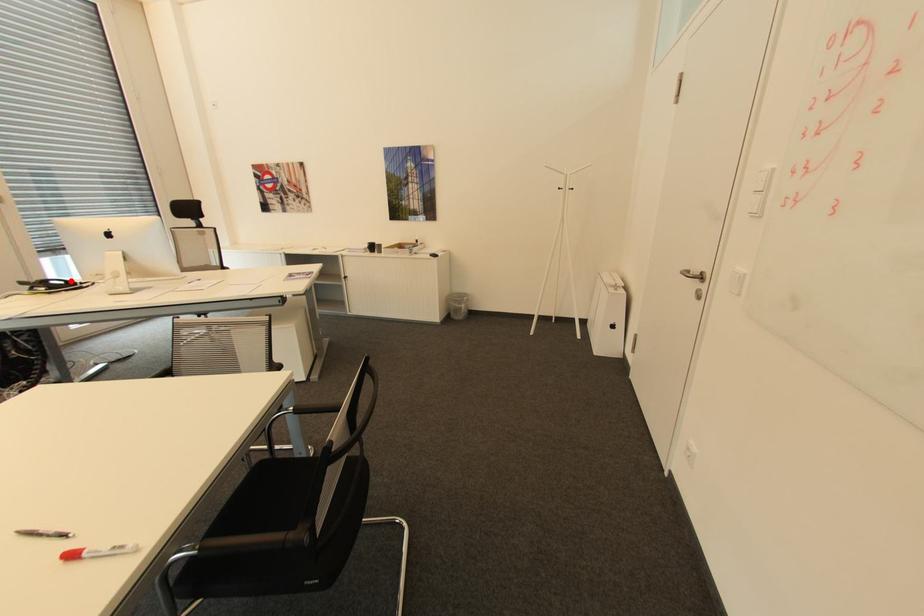
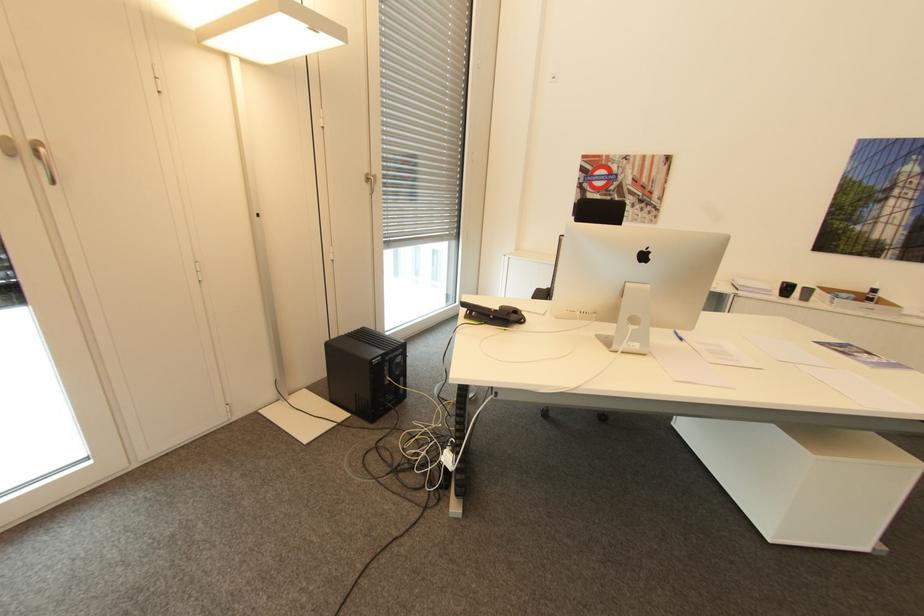
The point at the highlighted location is marked in the first image. Where is the corresponding point in the second image?

(520, 310)